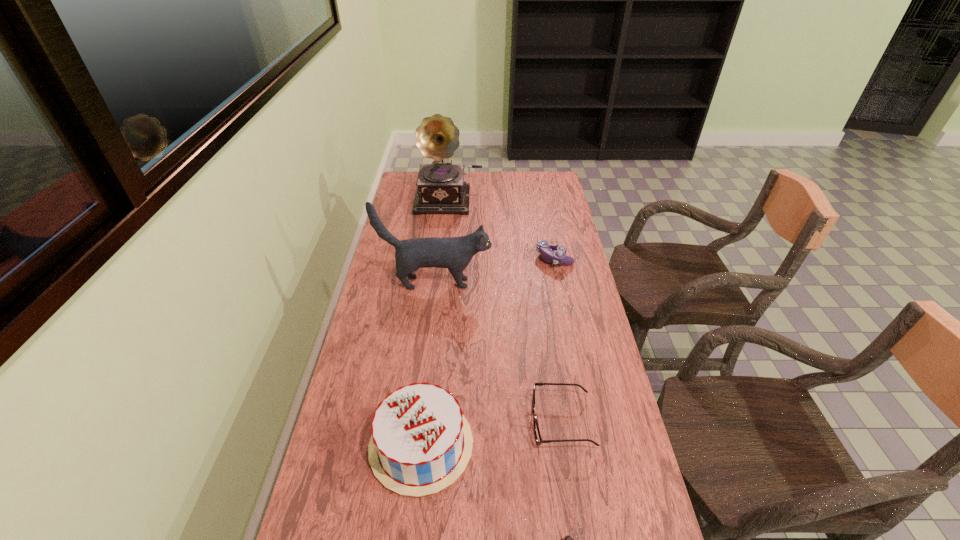
Find the location of `vacant space at the far edge`. vacant space at the far edge is located at coordinates (502, 180).

The image size is (960, 540). Find the location of `free space at the left edge of the desktop`. free space at the left edge of the desktop is located at coordinates (380, 313).

This screenshot has height=540, width=960. In the image, there is a desktop. Identify the location of blank space at the right edge. (579, 404).

You are a GUI agent. You are given a task and a screenshot of the screen. Output one action in this format:
    pyautogui.click(x=<x>, y=<y>)
    Task: Click on the vacant area that lies between the farther spectacles and the cat
    The width and height of the screenshot is (960, 540).
    Given the screenshot: What is the action you would take?
    pyautogui.click(x=498, y=352)

Where is `empty location between the control and the birthday cake`? empty location between the control and the birthday cake is located at coordinates (488, 351).

Find the location of a particular element. The image size is (960, 540). empty location between the birthday cake and the farther spectacles is located at coordinates 492,433.

Where is `vacant area between the third farthest object and the birthday cake`? vacant area between the third farthest object and the birthday cake is located at coordinates (428, 364).

The image size is (960, 540). In order to click on the closest object to the record player in this screenshot , I will do tap(547, 249).

The height and width of the screenshot is (540, 960). Find the location of `object that is the second nearest to the second tallest object`. object that is the second nearest to the second tallest object is located at coordinates (441, 188).

This screenshot has height=540, width=960. Identify the location of vacant space that satisfies the following two spatial constraints: 1. at the face of the cat; 2. on the right side of the fourth shortest object. (417, 445).